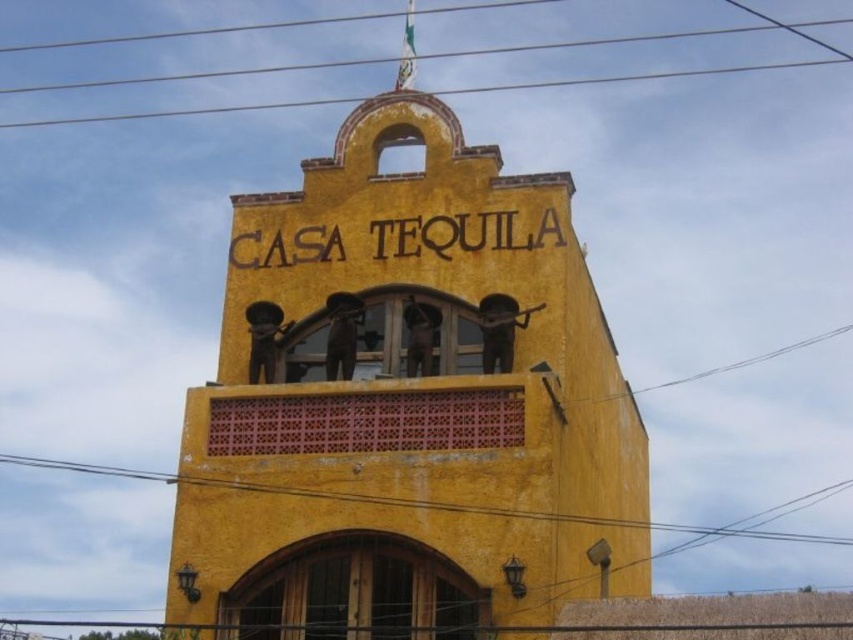
Question: Is metallic wire at upper center to the right of metallic wire at lower center from the viewer's perspective?

Choices:
 (A) no
 (B) yes

Answer: (B)

Question: Which of the following is the farthest from the observer?

Choices:
 (A) yellow stucco building at center
 (B) metallic wire at lower center

Answer: (B)

Question: Can you confirm if metallic wire at upper center is positioned below metallic wire at lower center?

Choices:
 (A) yes
 (B) no

Answer: (B)

Question: Which object is farther from the camera taking this photo?

Choices:
 (A) metallic wire at lower center
 (B) yellow stucco building at center
 (C) metallic wire at upper center

Answer: (C)

Question: Among these objects, which one is farthest from the camera?

Choices:
 (A) metallic wire at lower center
 (B) yellow stucco building at center

Answer: (A)

Question: Does yellow stucco building at center appear on the left side of metallic wire at upper center?

Choices:
 (A) no
 (B) yes

Answer: (A)